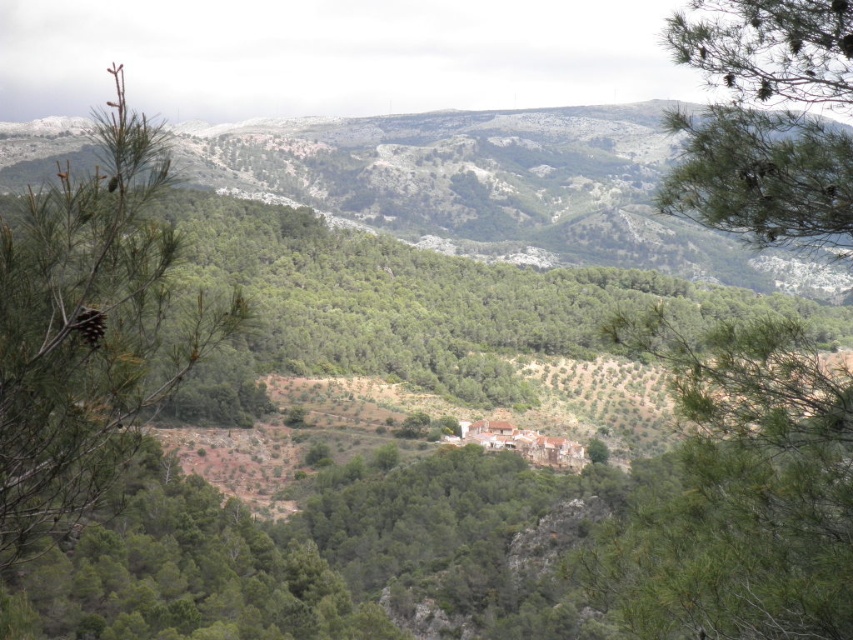
Consider the image. Does green needle-like branch at left appear over green needle-like at upper right?

Yes, green needle-like branch at left is above green needle-like at upper right.

Who is lower down, green needle-like branch at left or green needle-like at upper right?

Positioned lower is green needle-like at upper right.

Locate an element on the screen. The height and width of the screenshot is (640, 853). green needle-like branch at left is located at coordinates (91, 328).

I want to click on green needle-like branch at left, so click(91, 328).

From the picture: Does green leafy tree at center have a larger size compared to green needle-like branch at left?

Actually, green leafy tree at center might be smaller than green needle-like branch at left.

Which is above, green leafy tree at center or green needle-like branch at left?

Positioned higher is green needle-like branch at left.

Is point (722, 561) behind point (137, 403)?

Yes, it is.

This screenshot has width=853, height=640. Identify the location of green leafy tree at center. pos(737,492).

Is green leafy tree at center thinner than green needle-like at upper right?

In fact, green leafy tree at center might be wider than green needle-like at upper right.

Is green leafy tree at center to the right of green needle-like at upper right from the viewer's perspective?

Correct, you'll find green leafy tree at center to the right of green needle-like at upper right.

Is point (688, 584) positioned before point (752, 52)?

Yes, point (688, 584) is in front of point (752, 52).

Where is `green leafy tree at center`? The image size is (853, 640). green leafy tree at center is located at coordinates (737, 492).